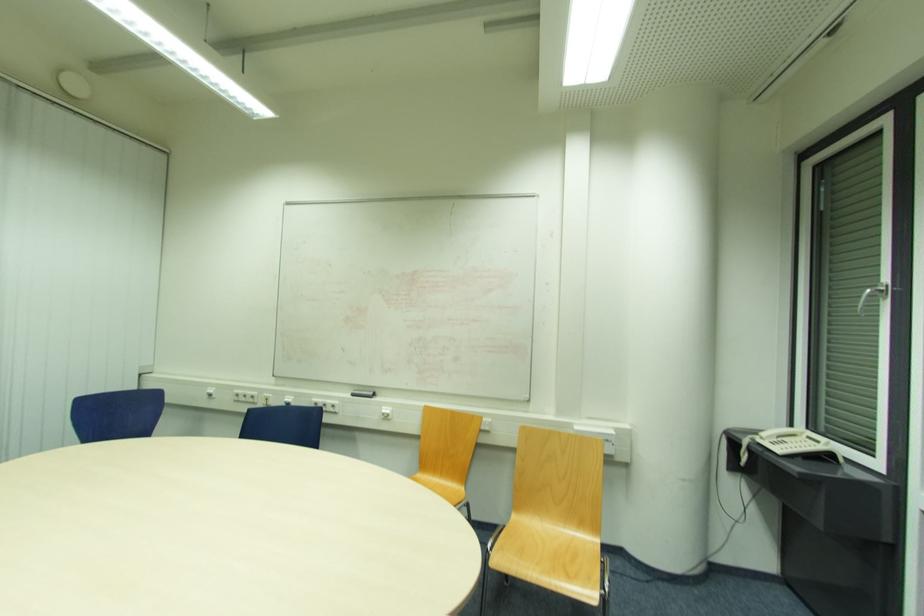
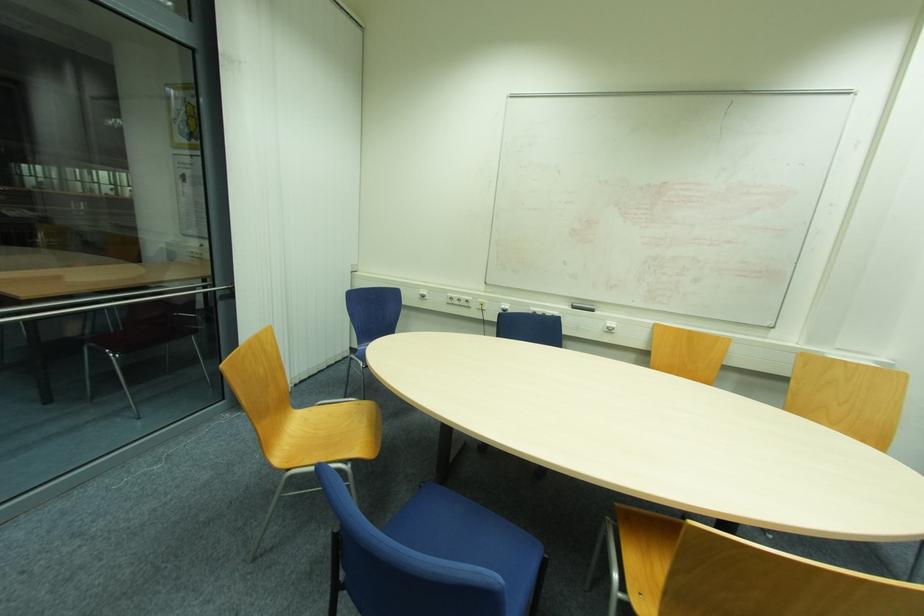
Question: In a continuous first-person perspective shot, in which direction is the camera moving?

Choices:
 (A) Left
 (B) Right
 (C) Forward
 (D) Backward

Answer: (A)